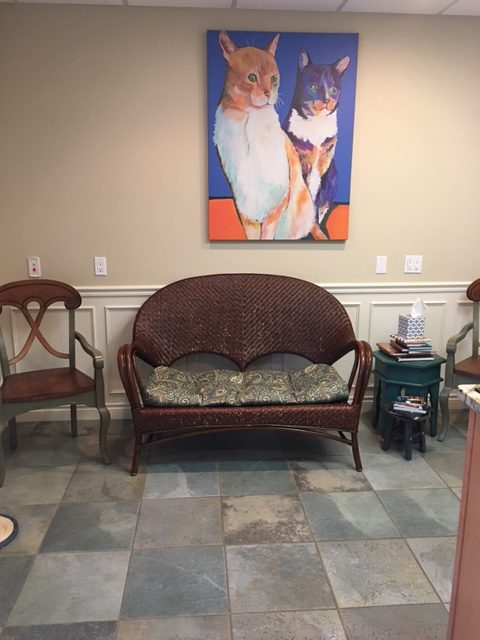
Find the location of a particular element. This screenshot has width=480, height=640. something to sit on is located at coordinates (234, 385), (54, 378), (468, 368).